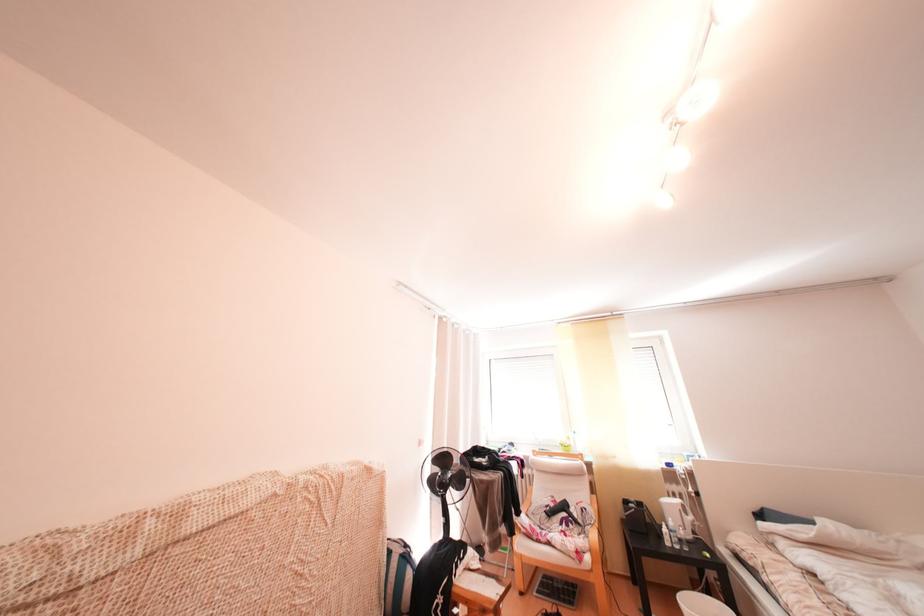
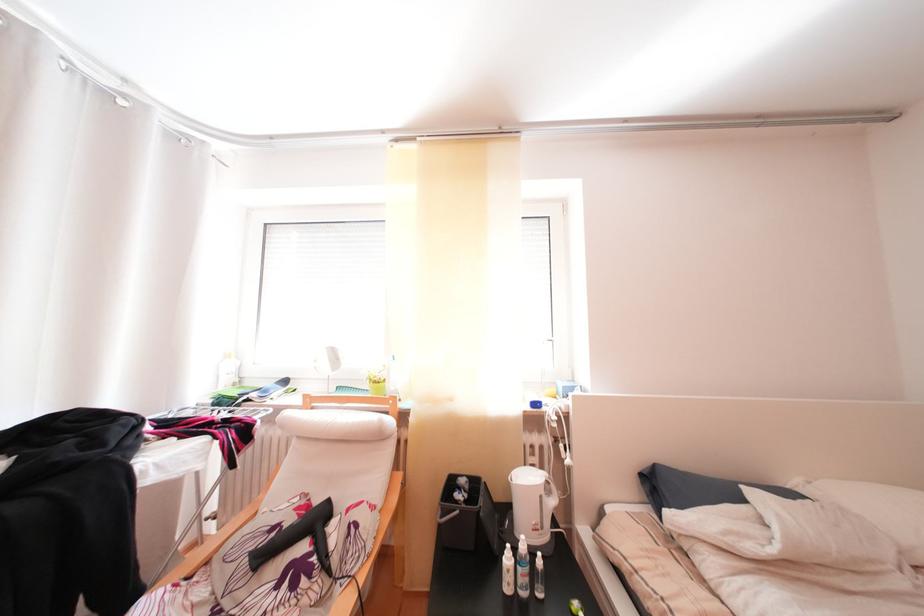
Where in the second image is the point corresponding to (645,505) from the first image?

(475, 487)